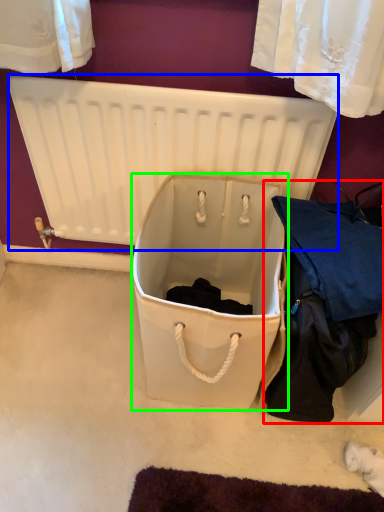
Question: Which object is the farthest from clothing (highlighted by a red box)? Choose among these: radiator (highlighted by a blue box) or storage box (highlighted by a green box).

Choices:
 (A) radiator
 (B) storage box

Answer: (A)